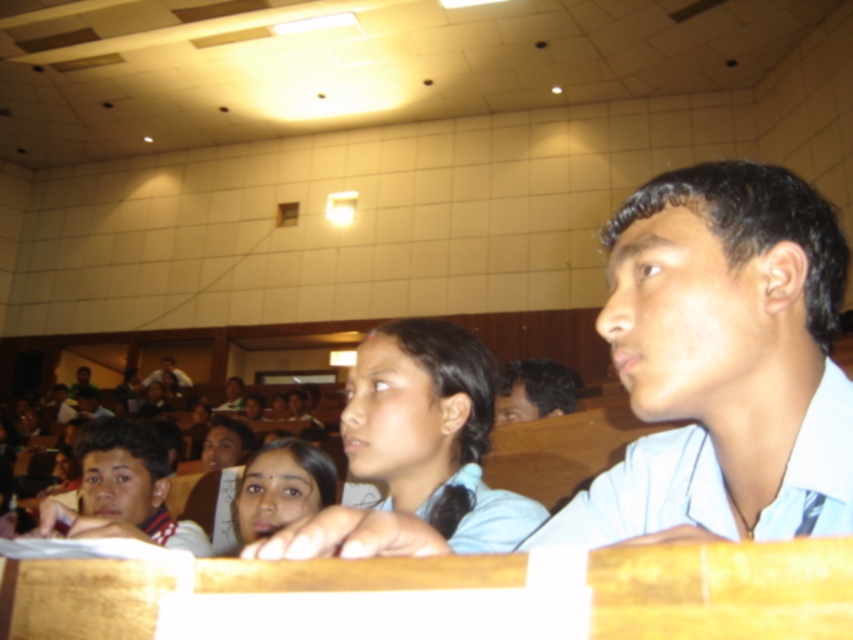
Which is more to the left, light blue shirt at center or matte white shirt at left?

From the viewer's perspective, matte white shirt at left appears more on the left side.

Can you confirm if light blue shirt at center is wider than matte white shirt at left?

Incorrect, light blue shirt at center's width does not surpass matte white shirt at left's.

Does point (676, 236) come farther from viewer compared to point (167, 516)?

No, (676, 236) is closer to viewer.

Identify the location of light blue shirt at center. (723, 364).

Can you confirm if light blue shirt at center is thinner than light brown wooden desk at center?

Indeed, light blue shirt at center has a lesser width compared to light brown wooden desk at center.

Find the location of a particular element. light blue shirt at center is located at coordinates (723, 364).

Is dark brown hair at center positioned before light brown wooden desk at center?

Yes, it is in front of light brown wooden desk at center.

In the scene shown: Who is positioned more to the right, dark brown hair at center or light brown wooden desk at center?

From the viewer's perspective, dark brown hair at center appears more on the right side.

The image size is (853, 640). Find the location of `dark brown hair at center`. dark brown hair at center is located at coordinates (532, 390).

Find the location of a particular element. Image resolution: width=853 pixels, height=640 pixels. dark brown hair at center is located at coordinates 532,390.